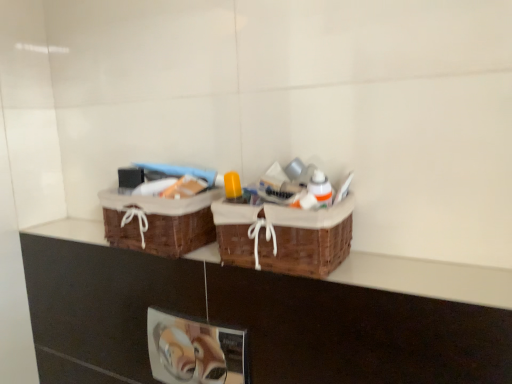
At what (x,y) coordinates should I click in order to perform the action: click on woven brown picnic basket at center, the 2th picnic basket positioned from the left. Please return your answer as a coordinate pair (x, y). Looking at the image, I should click on (284, 237).

Describe the element at coordinates (272, 311) in the screenshot. The width and height of the screenshot is (512, 384). I see `brown woven baskets at upper center` at that location.

Identify the location of brown woven picnic basket at center, positioned as the second picnic basket in right-to-left order. Image resolution: width=512 pixels, height=384 pixels. (159, 222).

You are a GUI agent. You are given a task and a screenshot of the screen. Output one action in this format:
    pyautogui.click(x=<x>, y=<y>)
    Task: Click on the woven brown picnic basket at center, the first picnic basket when ordered from right to left
    The height and width of the screenshot is (384, 512).
    Given the screenshot: What is the action you would take?
    pyautogui.click(x=284, y=237)

Is brown woven picnic basket at center, which is the first picnic basket in left-to-right order, taller than woven brown picnic basket at center, the first picnic basket when ordered from right to left?

Incorrect, the height of brown woven picnic basket at center, which is the first picnic basket in left-to-right order, is not larger of that of woven brown picnic basket at center, the first picnic basket when ordered from right to left.

Would you say brown woven picnic basket at center, positioned as the second picnic basket in right-to-left order, is a long distance from woven brown picnic basket at center, the 2th picnic basket positioned from the left?

They are positioned close to each other.

Would you say woven brown picnic basket at center, the 2th picnic basket positioned from the left, is part of brown woven picnic basket at center, positioned as the second picnic basket in right-to-left order,'s contents?

No.

Looking at this image, is brown woven picnic basket at center, which is the first picnic basket in left-to-right order, facing towards woven brown picnic basket at center, the 2th picnic basket positioned from the left?

No, brown woven picnic basket at center, which is the first picnic basket in left-to-right order, is not facing towards woven brown picnic basket at center, the 2th picnic basket positioned from the left.

Is woven brown picnic basket at center, the 2th picnic basket positioned from the left, in contact with brown woven baskets at upper center?

No, woven brown picnic basket at center, the 2th picnic basket positioned from the left, is not in contact with brown woven baskets at upper center.

Would you say woven brown picnic basket at center, the 2th picnic basket positioned from the left, is inside or outside brown woven baskets at upper center?

woven brown picnic basket at center, the 2th picnic basket positioned from the left, is outside brown woven baskets at upper center.

Considering the sizes of objects woven brown picnic basket at center, the 2th picnic basket positioned from the left, and brown woven baskets at upper center in the image provided, who is shorter, woven brown picnic basket at center, the 2th picnic basket positioned from the left, or brown woven baskets at upper center?

Standing shorter between the two is brown woven baskets at upper center.

From the image's perspective, between woven brown picnic basket at center, the 2th picnic basket positioned from the left, and brown woven baskets at upper center, who is located below?

brown woven baskets at upper center appears lower in the image.

Between woven brown picnic basket at center, the first picnic basket when ordered from right to left, and brown woven picnic basket at center, positioned as the second picnic basket in right-to-left order, which one has larger width?

Wider between the two is woven brown picnic basket at center, the first picnic basket when ordered from right to left.

Which point is more distant from viewer, (266, 224) or (202, 228)?

The point (202, 228) is farther.

Considering the positions of objects woven brown picnic basket at center, the first picnic basket when ordered from right to left, and brown woven picnic basket at center, which is the first picnic basket in left-to-right order, in the image provided, who is more to the left, woven brown picnic basket at center, the first picnic basket when ordered from right to left, or brown woven picnic basket at center, which is the first picnic basket in left-to-right order,?

From the viewer's perspective, brown woven picnic basket at center, which is the first picnic basket in left-to-right order, appears more on the left side.

From their relative heights in the image, would you say woven brown picnic basket at center, the first picnic basket when ordered from right to left, is taller or shorter than brown woven picnic basket at center, positioned as the second picnic basket in right-to-left order?

Answer: In the image, woven brown picnic basket at center, the first picnic basket when ordered from right to left, appears to be taller than brown woven picnic basket at center, positioned as the second picnic basket in right-to-left order.

Is brown woven picnic basket at center, which is the first picnic basket in left-to-right order, surrounded by brown woven baskets at upper center?

No, brown woven picnic basket at center, which is the first picnic basket in left-to-right order, is located outside of brown woven baskets at upper center.

There is a brown woven baskets at upper center. Where is `the 1st picnic basket above it (from a real-world perspective)`? the 1st picnic basket above it (from a real-world perspective) is located at coordinates (159, 222).

Is the surface of brown woven baskets at upper center in direct contact with brown woven picnic basket at center, which is the first picnic basket in left-to-right order?

No, brown woven baskets at upper center is not beside brown woven picnic basket at center, which is the first picnic basket in left-to-right order.

Considering the sizes of objects brown woven baskets at upper center and woven brown picnic basket at center, the first picnic basket when ordered from right to left, in the image provided, who is shorter, brown woven baskets at upper center or woven brown picnic basket at center, the first picnic basket when ordered from right to left,?

Standing shorter between the two is brown woven baskets at upper center.

Does point (79, 264) lie in front of point (290, 211)?

No.

Is brown woven baskets at upper center at the left side of woven brown picnic basket at center, the first picnic basket when ordered from right to left?

Correct, you'll find brown woven baskets at upper center to the left of woven brown picnic basket at center, the first picnic basket when ordered from right to left.

Can you tell me how much brown woven baskets at upper center and woven brown picnic basket at center, the first picnic basket when ordered from right to left, differ in facing direction?

There is a 0.0895-degree angle between the facing directions of brown woven baskets at upper center and woven brown picnic basket at center, the first picnic basket when ordered from right to left.

This screenshot has width=512, height=384. I want to click on the 1st picnic basket positioned above the brown woven baskets at upper center (from a real-world perspective), so click(159, 222).

From the image's perspective, is brown woven picnic basket at center, which is the first picnic basket in left-to-right order, beneath brown woven baskets at upper center?

Incorrect, from the image's perspective, brown woven picnic basket at center, which is the first picnic basket in left-to-right order, is higher than brown woven baskets at upper center.

Does brown woven picnic basket at center, which is the first picnic basket in left-to-right order, have a lesser height compared to brown woven baskets at upper center?

In fact, brown woven picnic basket at center, which is the first picnic basket in left-to-right order, may be taller than brown woven baskets at upper center.

At what (x,y) coordinates should I click in order to perform the action: click on picnic basket that appears behind the woven brown picnic basket at center, the first picnic basket when ordered from right to left. Please return your answer as a coordinate pair (x, y). The width and height of the screenshot is (512, 384). Looking at the image, I should click on (159, 222).

The width and height of the screenshot is (512, 384). Identify the location of picnic basket that is on the right side of brown woven baskets at upper center. (284, 237).

Based on their spatial positions, is woven brown picnic basket at center, the first picnic basket when ordered from right to left, or brown woven picnic basket at center, which is the first picnic basket in left-to-right order, further from brown woven baskets at upper center?

woven brown picnic basket at center, the first picnic basket when ordered from right to left, is further to brown woven baskets at upper center.

Estimate the real-world distances between objects in this image. Which object is closer to brown woven picnic basket at center, which is the first picnic basket in left-to-right order, woven brown picnic basket at center, the 2th picnic basket positioned from the left, or brown woven baskets at upper center?

The object closer to brown woven picnic basket at center, which is the first picnic basket in left-to-right order, is brown woven baskets at upper center.

Considering their positions, is brown woven picnic basket at center, which is the first picnic basket in left-to-right order, positioned further to brown woven baskets at upper center than woven brown picnic basket at center, the 2th picnic basket positioned from the left?

woven brown picnic basket at center, the 2th picnic basket positioned from the left, is further to brown woven baskets at upper center.

Considering their positions, is brown woven baskets at upper center positioned closer to woven brown picnic basket at center, the first picnic basket when ordered from right to left, than brown woven picnic basket at center, positioned as the second picnic basket in right-to-left order?

brown woven baskets at upper center lies closer to woven brown picnic basket at center, the first picnic basket when ordered from right to left, than the other object.

From the image, which object appears to be nearer to brown woven picnic basket at center, positioned as the second picnic basket in right-to-left order, brown woven baskets at upper center or woven brown picnic basket at center, the 2th picnic basket positioned from the left?

The object closer to brown woven picnic basket at center, positioned as the second picnic basket in right-to-left order, is brown woven baskets at upper center.

Considering their positions, is brown woven picnic basket at center, positioned as the second picnic basket in right-to-left order, positioned closer to woven brown picnic basket at center, the 2th picnic basket positioned from the left, than brown woven baskets at upper center?

brown woven baskets at upper center is closer to woven brown picnic basket at center, the 2th picnic basket positioned from the left.

At what (x,y) coordinates should I click in order to perform the action: click on counter located between brown woven picnic basket at center, which is the first picnic basket in left-to-right order, and woven brown picnic basket at center, the first picnic basket when ordered from right to left, in the left-right direction. Please return your answer as a coordinate pair (x, y). Image resolution: width=512 pixels, height=384 pixels. Looking at the image, I should click on (272, 311).